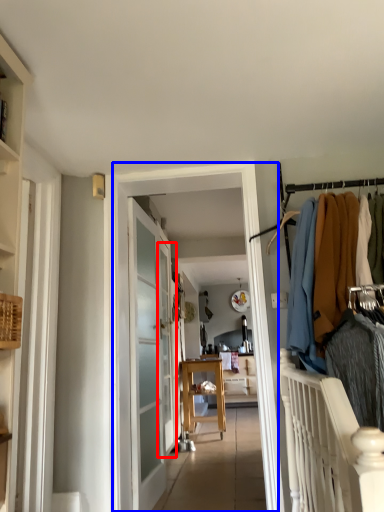
Question: Which object appears farthest to the camera in this image, screen door (highlighted by a red box) or clothing store (highlighted by a blue box)?

Choices:
 (A) screen door
 (B) clothing store

Answer: (A)